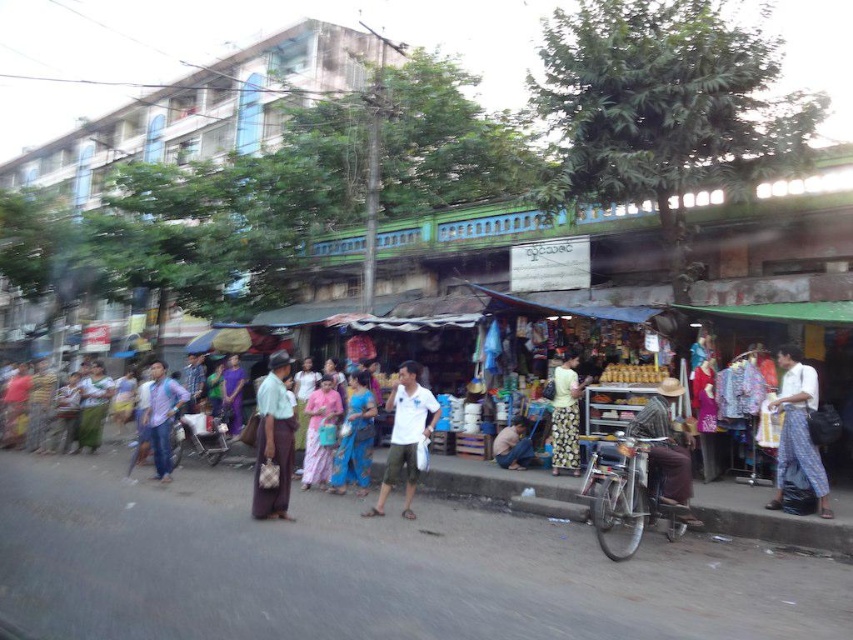
You are a delivery person who needs to navigate between the green fabric skirt at center and the floral fabric skirt at center. The delivery cart you are using is 3 feet wide. Is there enough space for the cart to pass through the gap between them?

The distance between the green fabric skirt at center and the floral fabric skirt at center is 12.71 feet. Since the cart is only 3 feet wide, there is sufficient space for the cart to pass through the gap between them.

You are a delivery person carrying a package that is 6 feet long. You need to navigate between the white matte shirt at center and the blue fabric bag at lower center. Can you fit through the space between them without tilting the package?

The distance between the white matte shirt at center and the blue fabric bag at lower center is 6.90 feet. Since the package is 6 feet long, it can fit through the space as the distance is slightly larger than the package length.

You are a photographer trying to capture the man in the white matte shirt at center. Where should you position your camera to get the best shot?

To capture the man in the white matte shirt at center, position your camera near the coordinates point mentioned in the description, which is at point (405, 435).